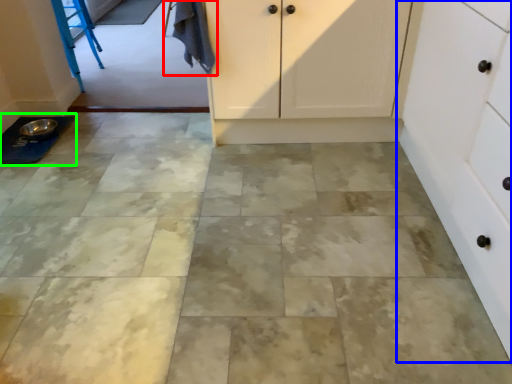
Question: Based on their relative distances, which object is nearer to laundry (highlighted by a red box)? Choose from cabinetry (highlighted by a blue box) and sink (highlighted by a green box).

Choices:
 (A) cabinetry
 (B) sink

Answer: (B)